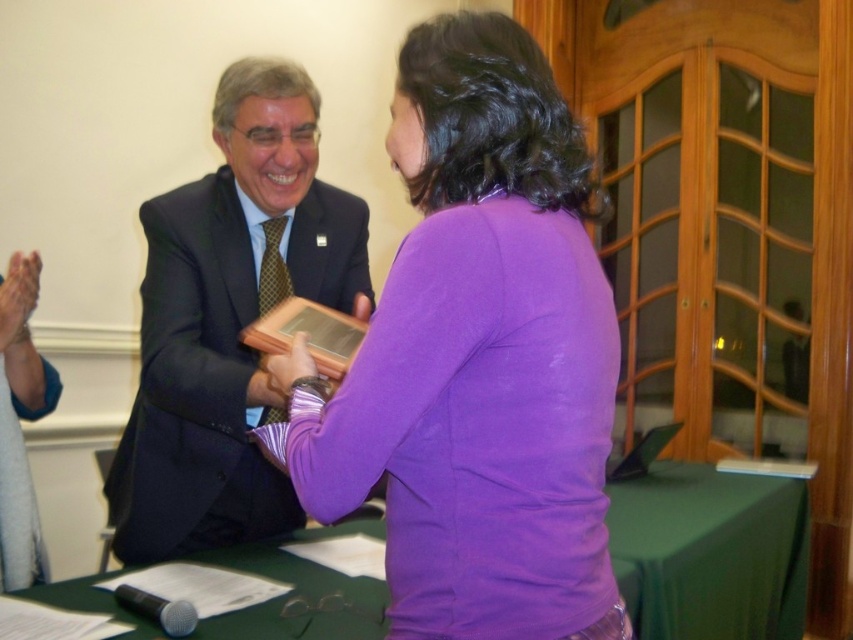
Question: Which point is farther to the camera?

Choices:
 (A) purple matte shirt at center
 (B) green fabric table at center

Answer: (B)

Question: Which is nearer to the matte black suit at center?

Choices:
 (A) green fabric table at center
 (B) purple matte shirt at center

Answer: (B)

Question: Does matte black suit at center have a larger size compared to green fabric table at center?

Choices:
 (A) no
 (B) yes

Answer: (A)

Question: Which is nearer to the purple matte shirt at center?

Choices:
 (A) matte black suit at center
 (B) green fabric table at center

Answer: (A)

Question: Can you confirm if matte black suit at center is positioned above green fabric table at center?

Choices:
 (A) no
 (B) yes

Answer: (B)

Question: Does matte black suit at center have a larger size compared to green fabric table at center?

Choices:
 (A) no
 (B) yes

Answer: (A)